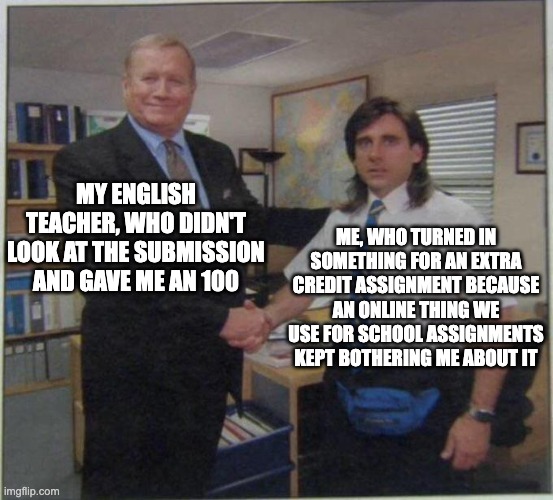
Find the location of a particular element. The width and height of the screenshot is (553, 500). framed diploma is located at coordinates (536, 150).